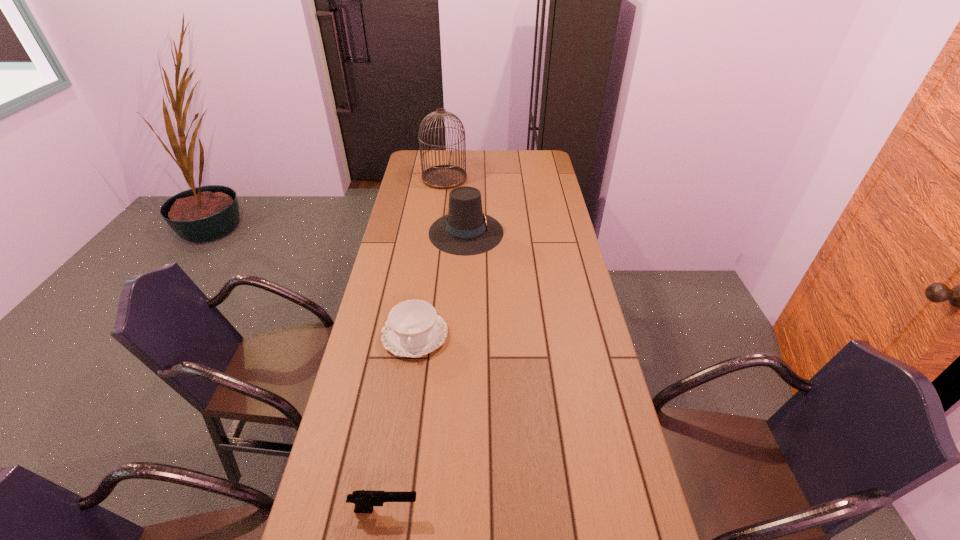
Where is `object that is at the far edge`? This screenshot has width=960, height=540. object that is at the far edge is located at coordinates (444, 176).

I want to click on birdcage that is positioned at the left edge, so (x=444, y=176).

The width and height of the screenshot is (960, 540). Identify the location of pistol at the left edge. (364, 500).

This screenshot has width=960, height=540. I want to click on chinaware at the left edge, so (x=413, y=329).

The height and width of the screenshot is (540, 960). What are the coordinates of `object positioned at the far left corner` in the screenshot? It's located at (444, 176).

Identify the location of vacant area at the far edge of the desktop. The image size is (960, 540). (473, 152).

Where is `vacant space at the left edge of the desktop`? This screenshot has width=960, height=540. vacant space at the left edge of the desktop is located at coordinates (381, 301).

In the image, there is a desktop. Where is `blank space at the right edge`? The image size is (960, 540). blank space at the right edge is located at coordinates (549, 211).

This screenshot has height=540, width=960. I want to click on empty location between the pistol and the third shortest object, so click(425, 371).

The width and height of the screenshot is (960, 540). Find the location of `vacant space that is in between the hat and the third farthest object`. vacant space that is in between the hat and the third farthest object is located at coordinates (441, 284).